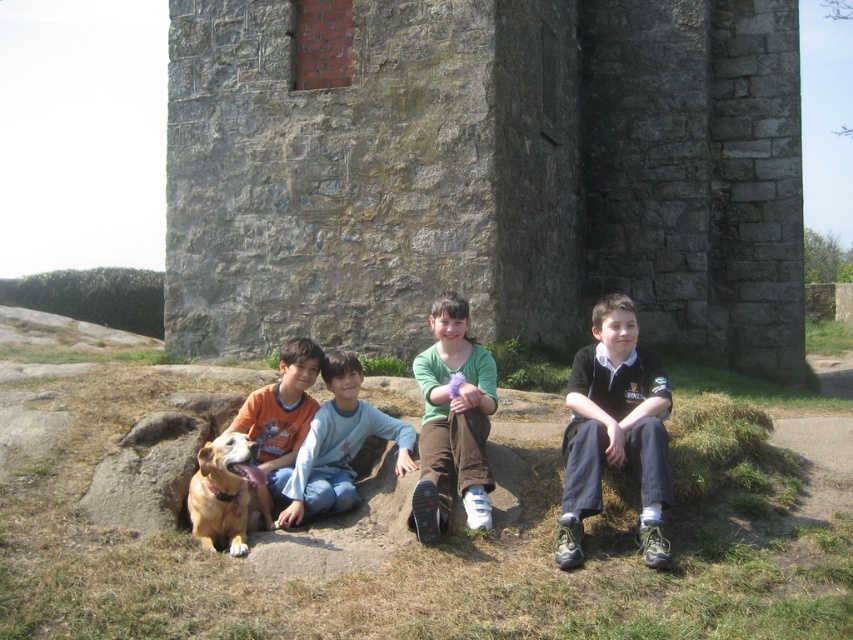
Question: Which point appears farthest from the camera in this image?

Choices:
 (A) (187, 218)
 (B) (643, 524)

Answer: (A)

Question: Which point is farther to the camera?

Choices:
 (A) (575, 540)
 (B) (451, 442)
 (C) (212, 532)
 (D) (312, 412)

Answer: (D)

Question: Is dark blue uniform at center wider than golden fur dog at lower left?

Choices:
 (A) yes
 (B) no

Answer: (A)

Question: Can you confirm if dark blue uniform at center is bigger than light blue cotton shirt at center?

Choices:
 (A) no
 (B) yes

Answer: (B)

Question: From the image, what is the correct spatial relationship of light blue cotton shirt at center in relation to golden fur dog at lower left?

Choices:
 (A) right
 (B) left

Answer: (A)

Question: Estimate the real-world distances between objects in this image. Which object is closer to the light blue cotton shirt at center?

Choices:
 (A) golden fur dog at lower left
 (B) dark blue uniform at center

Answer: (A)